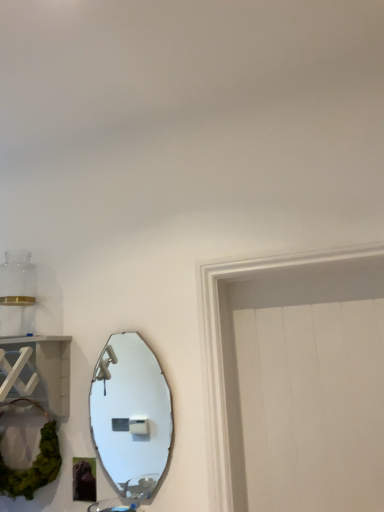
Question: From the image's perspective, is matte silver mirror at center-left located beneath white wood shelf at left?

Choices:
 (A) no
 (B) yes

Answer: (B)

Question: From the image's perspective, is matte silver mirror at center-left above white wood shelf at left?

Choices:
 (A) no
 (B) yes

Answer: (A)

Question: Is matte silver mirror at center-left next to white wood shelf at left?

Choices:
 (A) no
 (B) yes

Answer: (A)

Question: Is matte silver mirror at center-left positioned in front of white wood shelf at left?

Choices:
 (A) no
 (B) yes

Answer: (A)

Question: From a real-world perspective, is matte silver mirror at center-left over white wood shelf at left?

Choices:
 (A) yes
 (B) no

Answer: (B)

Question: From a real-world perspective, does matte silver mirror at center-left sit lower than white wood shelf at left?

Choices:
 (A) yes
 (B) no

Answer: (A)

Question: Would you say white wood shelf at left contains matte silver mirror at center-left?

Choices:
 (A) yes
 (B) no

Answer: (B)

Question: Could you tell me if white wood shelf at left is turned towards matte silver mirror at center-left?

Choices:
 (A) no
 (B) yes

Answer: (A)

Question: Can you confirm if white wood shelf at left is positioned to the right of matte silver mirror at center-left?

Choices:
 (A) yes
 (B) no

Answer: (B)

Question: Considering the relative sizes of white wood shelf at left and matte silver mirror at center-left in the image provided, is white wood shelf at left thinner than matte silver mirror at center-left?

Choices:
 (A) no
 (B) yes

Answer: (A)

Question: Is there a large distance between white wood shelf at left and matte silver mirror at center-left?

Choices:
 (A) no
 (B) yes

Answer: (B)

Question: From a real-world perspective, is white wood shelf at left physically below matte silver mirror at center-left?

Choices:
 (A) no
 (B) yes

Answer: (A)

Question: From a real-world perspective, is matte silver mirror at center-left positioned above or below white wood shelf at left?

Choices:
 (A) above
 (B) below

Answer: (B)